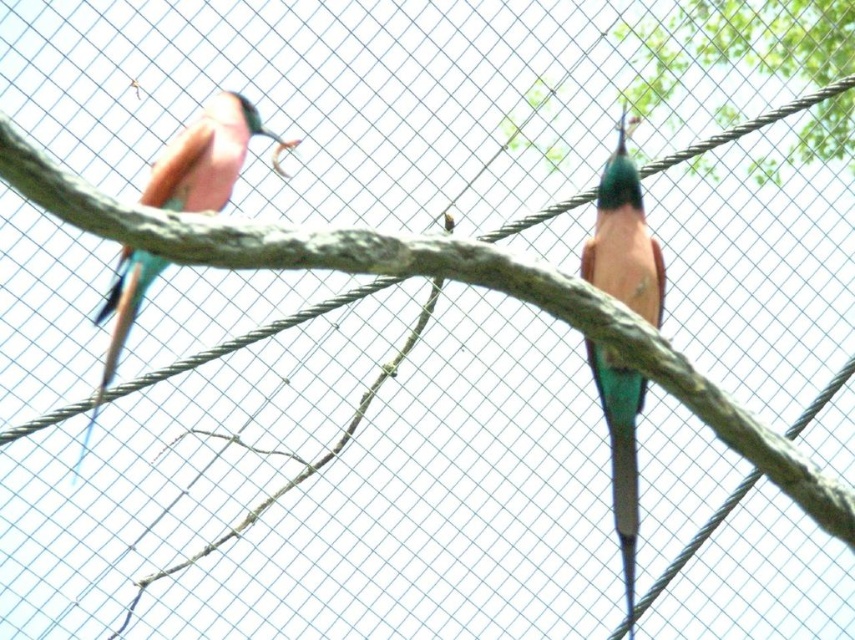
Can you confirm if teal glossy parrot at center is thinner than pink glossy bird at left?

Indeed, teal glossy parrot at center has a lesser width compared to pink glossy bird at left.

Does teal glossy parrot at center appear on the left side of pink glossy bird at left?

No, teal glossy parrot at center is not to the left of pink glossy bird at left.

What do you see at coordinates (624, 241) in the screenshot?
I see `teal glossy parrot at center` at bounding box center [624, 241].

The height and width of the screenshot is (640, 855). I want to click on teal glossy parrot at center, so click(x=624, y=241).